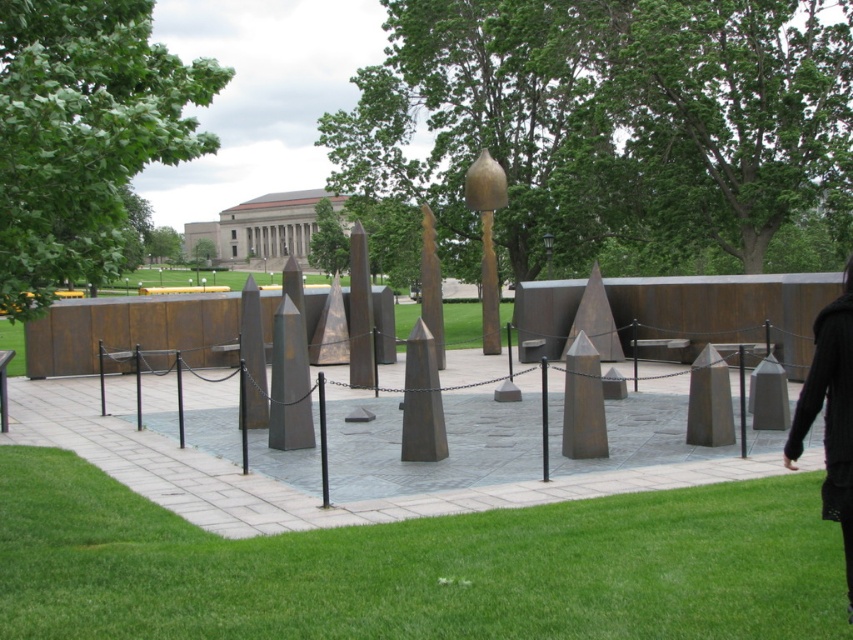
You are a visitor at the memorial garden and want to place your black wool coat somewhere. You have two options on the ground near the structures. One is the green grass at lower center and the other is the black wool coat at lower right. Which location has more space to accommodate the coat?

The black wool coat at lower right has more space compared to the green grass at lower center since the green grass at lower center has a smaller size.

You are a visitor at the memorial garden. You notice the black wool coat at lower right and the gold matte obelisk at center. Which object takes up more area in the image?

The gold matte obelisk at center takes up more area in the image than the black wool coat at lower right because the black wool coat at lower right occupies less space than gold matte obelisk at center.